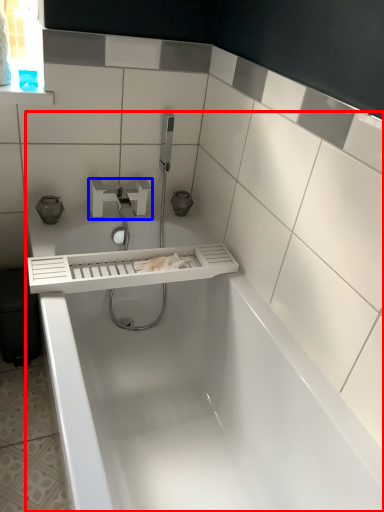
Question: Among these objects, which one is farthest to the camera, bathtub (highlighted by a red box) or tap (highlighted by a blue box)?

Choices:
 (A) bathtub
 (B) tap

Answer: (B)